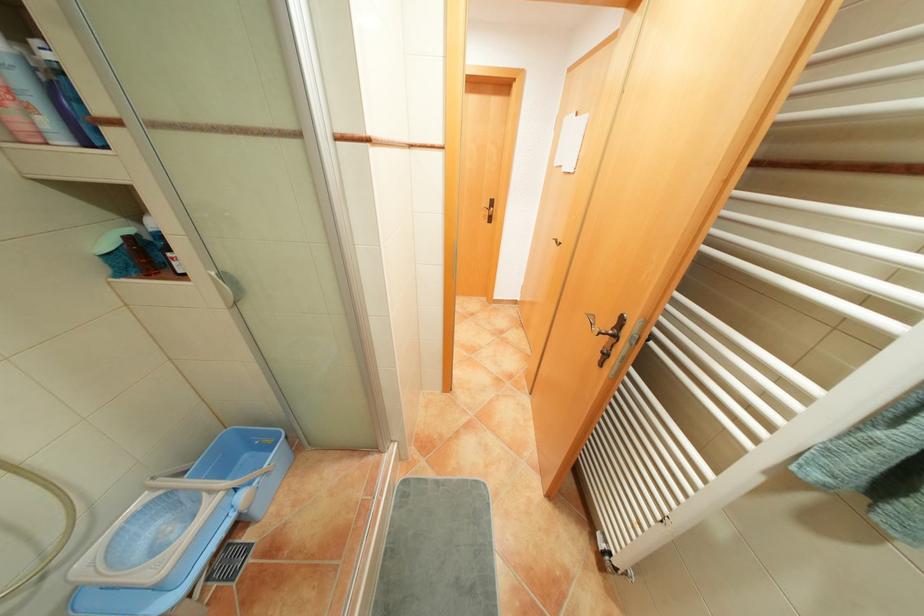
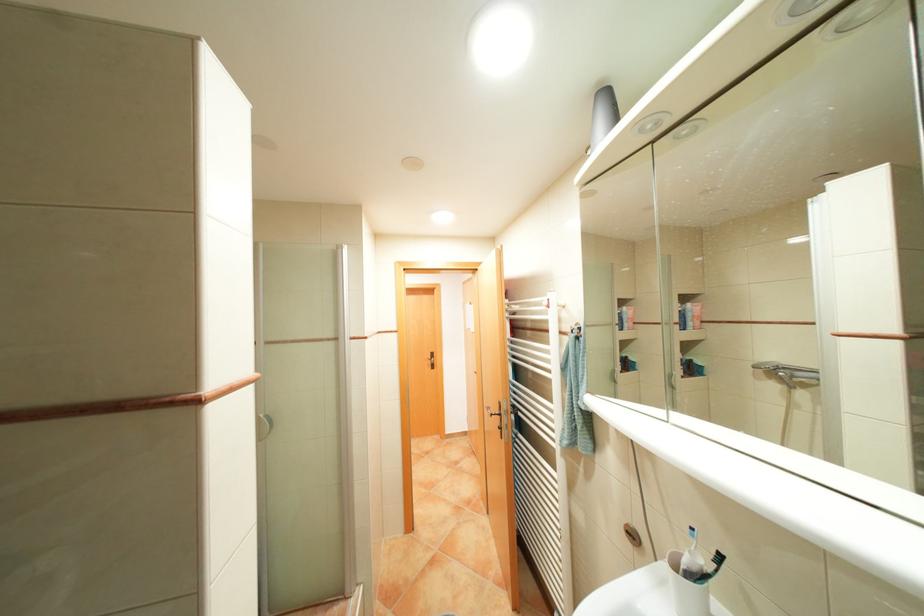
The images are taken continuously from a first-person perspective. In which direction is your viewpoint rotating?

The camera's rotation is toward right-up.